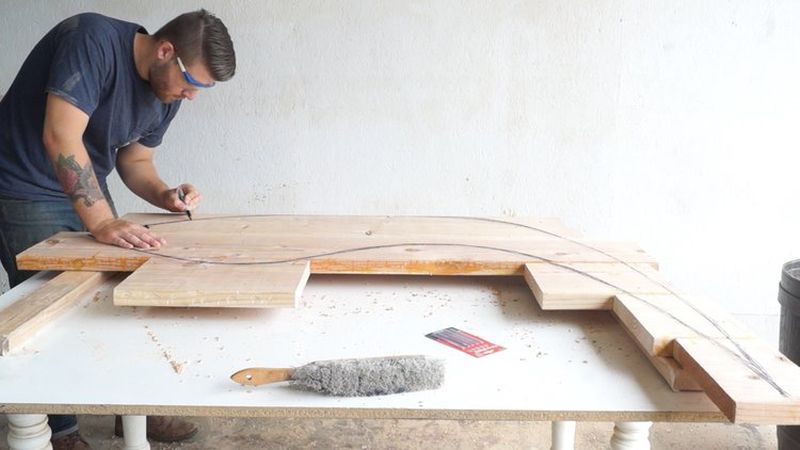
You are a GUI agent. You are given a task and a screenshot of the screen. Output one action in this format:
    pyautogui.click(x=<x>, y=<y>)
    Task: Click on the wall
    The width and height of the screenshot is (800, 450).
    Given the screenshot: What is the action you would take?
    pyautogui.click(x=358, y=122)